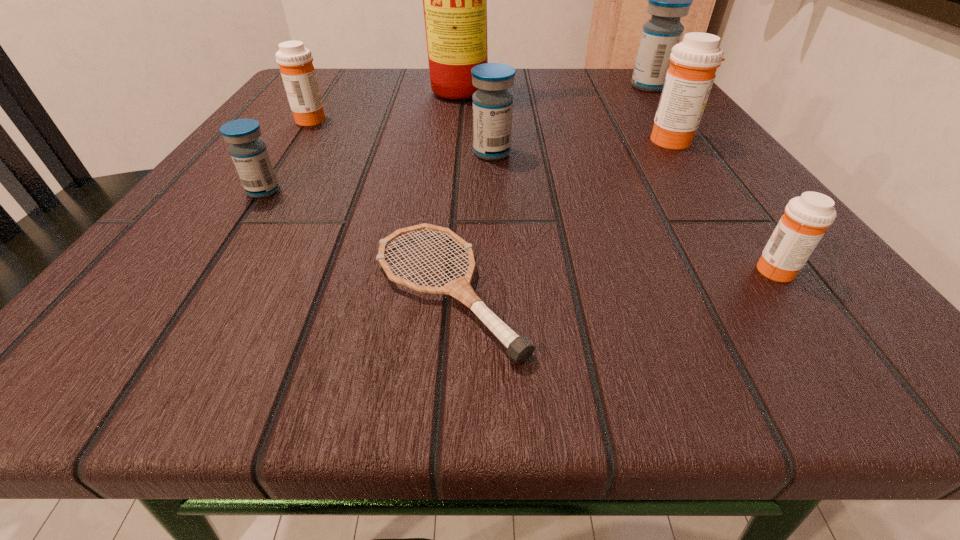
Where is `fire extinguisher`? fire extinguisher is located at coordinates (454, 0).

The width and height of the screenshot is (960, 540). Find the location of `red fire extinguisher`. red fire extinguisher is located at coordinates (454, 0).

You are a GUI agent. You are given a task and a screenshot of the screen. Output one action in this format:
    pyautogui.click(x=<x>, y=<y>)
    Task: Click on the biggest blue medicine
    The image size is (960, 540).
    Given the screenshot: What is the action you would take?
    pyautogui.click(x=668, y=0)

Identify the location of the rightmost blue medicine. (668, 0).

Find the location of a particular element. This screenshot has height=540, width=960. the biggest orange medicine is located at coordinates (689, 79).

Locate an element on the screen. the second farthest blue medicine is located at coordinates (492, 104).

Find the location of a particular element. Image resolution: width=960 pixels, height=540 pixels. the fourth medicine from right to left is located at coordinates coord(492,104).

I want to click on the third farthest object, so click(x=295, y=61).

The image size is (960, 540). What are the coordinates of `the fifth nearest medicine` in the screenshot? It's located at (295, 61).

This screenshot has height=540, width=960. In order to click on the nearest blue medicine in this screenshot , I will do `click(250, 156)`.